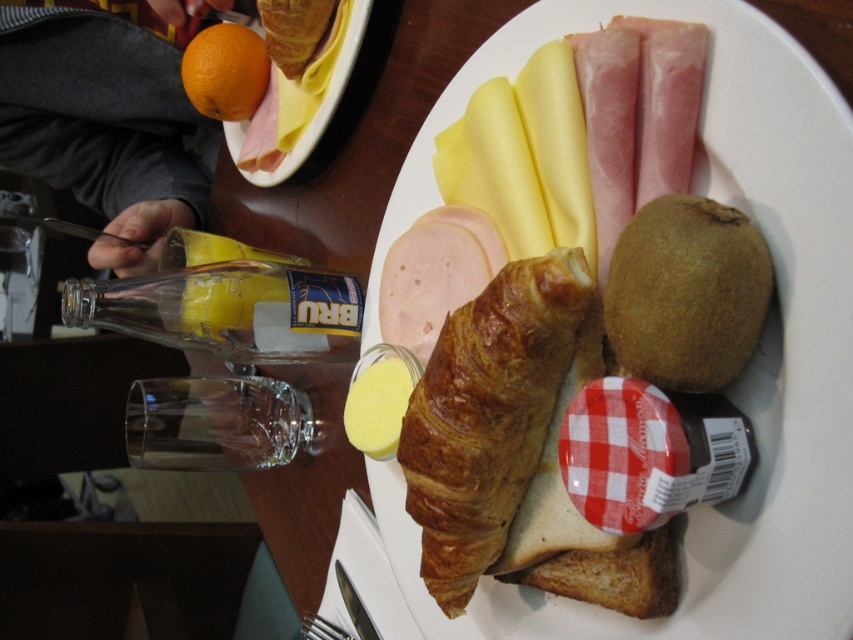
Question: Does golden brown flaky croissant at center have a greater width compared to brown fuzzy kiwi at right?

Choices:
 (A) yes
 (B) no

Answer: (A)

Question: Can you confirm if brown fuzzy kiwi at right is positioned below transparent glass at lower left?

Choices:
 (A) yes
 (B) no

Answer: (B)

Question: Which object is farther from the camera taking this photo?

Choices:
 (A) golden brown croissant at center
 (B) clear glass bottle at lower left
 (C) orangesmoothfruit at upper left
 (D) transparent glass at lower left

Answer: (C)

Question: Which object is positioned closest to the transparent glass at lower left?

Choices:
 (A) orangesmoothfruit at upper left
 (B) orange matte fruit at upper left

Answer: (B)

Question: Does golden brown croissant at center have a smaller size compared to clear glass bottle at lower left?

Choices:
 (A) no
 (B) yes

Answer: (A)

Question: Considering the real-world distances, which object is closest to the toasted white bread at lower center?

Choices:
 (A) transparent glass at lower left
 (B) orange matte fruit at upper left
 (C) orangesmoothfruit at upper left
 (D) golden brown flaky croissant at center

Answer: (D)